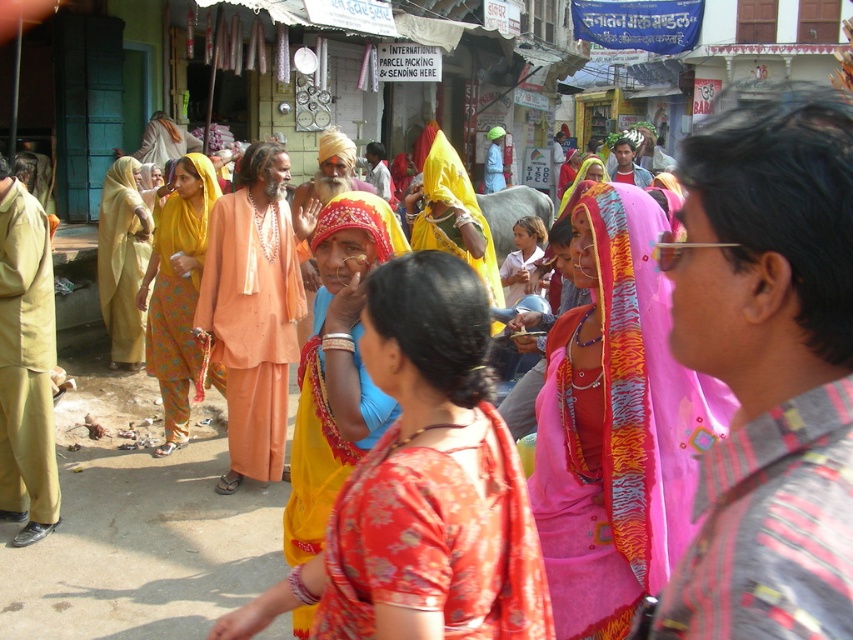
Who is taller, pink satin saree at center or silky red sari at center?

pink satin saree at center is taller.

Who is positioned more to the right, pink satin saree at center or silky red sari at center?

Positioned to the right is pink satin saree at center.

What do you see at coordinates (616, 424) in the screenshot? I see `pink satin saree at center` at bounding box center [616, 424].

Where is `pink satin saree at center`? pink satin saree at center is located at coordinates (616, 424).

Between silky red sari at center and yellow silk saree at center, which one has more height?

With more height is yellow silk saree at center.

Does silky red sari at center have a lesser width compared to yellow silk saree at center?

No, silky red sari at center is not thinner than yellow silk saree at center.

This screenshot has height=640, width=853. Identify the location of silky red sari at center. tap(434, 544).

Find the location of a particular element. silky red sari at center is located at coordinates (434, 544).

Is pink fabric at center above yellow silk saree at center?

Yes, pink fabric at center is above yellow silk saree at center.

Can you confirm if pink fabric at center is thinner than yellow silk saree at center?

Indeed, pink fabric at center has a lesser width compared to yellow silk saree at center.

Is point (830, 515) in front of point (302, 624)?

Yes, it is.

Identify the location of pink fabric at center. (770, 529).